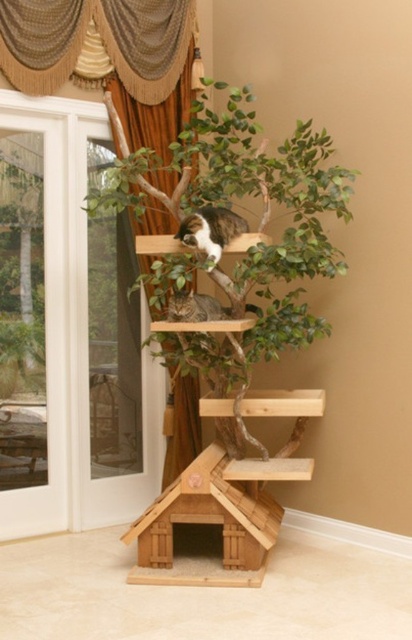
Question: Which of these objects is positioned farthest from the wooden cat tree at center?

Choices:
 (A) tabby fur cat at center
 (B) tabby fur cat at upper center

Answer: (A)

Question: Considering the real-world distances, which object is closest to the tabby fur cat at upper center?

Choices:
 (A) tabby fur cat at center
 (B) wooden cat tree at center

Answer: (A)

Question: Among these objects, which one is nearest to the camera?

Choices:
 (A) tabby fur cat at center
 (B) wooden cat tree at center
 (C) tabby fur cat at upper center

Answer: (B)

Question: Does tabby fur cat at upper center appear over tabby fur cat at center?

Choices:
 (A) no
 (B) yes

Answer: (B)

Question: Can you confirm if wooden cat tree at center is positioned above tabby fur cat at upper center?

Choices:
 (A) yes
 (B) no

Answer: (B)

Question: Is wooden cat tree at center thinner than tabby fur cat at upper center?

Choices:
 (A) yes
 (B) no

Answer: (B)